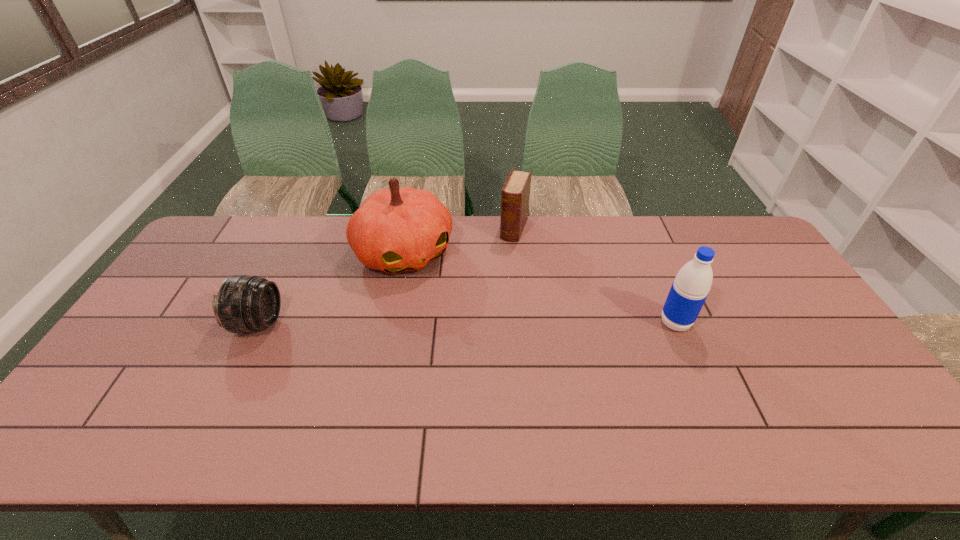
The height and width of the screenshot is (540, 960). What are the coordinates of `blank area located 0.130m on the spine side of the third tallest object` in the screenshot? It's located at (501, 267).

Where is `blank space located on the front-facing side of the third object from right to left`? blank space located on the front-facing side of the third object from right to left is located at coordinates (442, 304).

At what (x,y) coordinates should I click in order to perform the action: click on vacant area situated on the front-facing side of the third object from right to left. Please return your answer as a coordinate pair (x, y). The width and height of the screenshot is (960, 540). Looking at the image, I should click on (x=439, y=300).

This screenshot has height=540, width=960. Identify the location of vacant space located 0.330m on the front-facing side of the third object from right to left. (480, 355).

Where is `diary situated at the far edge`? The width and height of the screenshot is (960, 540). diary situated at the far edge is located at coordinates (515, 197).

At what (x,y) coordinates should I click in order to perform the action: click on pumpkin present at the far edge. Please return your answer as a coordinate pair (x, y). Looking at the image, I should click on point(395,230).

Locate an element on the screen. vacant area at the far edge of the desktop is located at coordinates (463, 243).

The width and height of the screenshot is (960, 540). In order to click on blank area at the near edge in this screenshot , I will do `click(619, 388)`.

Identify the location of free region at the left edge of the desktop. (159, 362).

Image resolution: width=960 pixels, height=540 pixels. In the image, there is a desktop. What are the coordinates of `blank space at the right edge` in the screenshot? It's located at (776, 267).